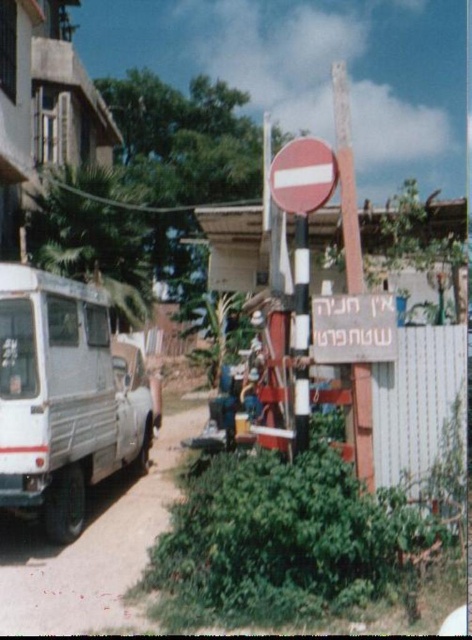
Who is positioned more to the right, white matte van at left or white striped pole at center?

From the viewer's perspective, white striped pole at center appears more on the right side.

Which is above, white matte van at left or white striped pole at center?

white striped pole at center is higher up.

Who is more distant from viewer, (x=38, y=317) or (x=303, y=436)?

The point (x=38, y=317) is behind.

Where is `white matte van at left`? Image resolution: width=472 pixels, height=640 pixels. white matte van at left is located at coordinates (65, 397).

Image resolution: width=472 pixels, height=640 pixels. What are the coordinates of `smooth red circle at center` in the screenshot? It's located at (303, 176).

What do you see at coordinates (303, 176) in the screenshot? This screenshot has width=472, height=640. I see `smooth red circle at center` at bounding box center [303, 176].

You are a GUI agent. You are given a task and a screenshot of the screen. Output one action in this format:
    pyautogui.click(x=<x>, y=<y>)
    Task: Click on the smooth red circle at center
    Image resolution: width=472 pixels, height=640 pixels.
    Given the screenshot: What is the action you would take?
    pyautogui.click(x=303, y=176)

Which is more to the left, white matte van at left or smooth wooden signpost at center?

Positioned to the left is white matte van at left.

Does white matte van at left have a lesser width compared to smooth wooden signpost at center?

Yes, white matte van at left is thinner than smooth wooden signpost at center.

Where is `white matte van at left`? The height and width of the screenshot is (640, 472). white matte van at left is located at coordinates (65, 397).

Identify the location of white matte van at left. This screenshot has height=640, width=472. (65, 397).